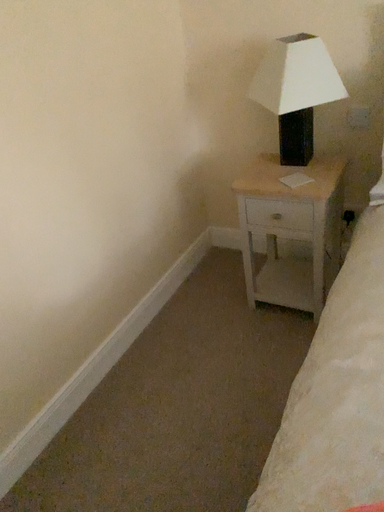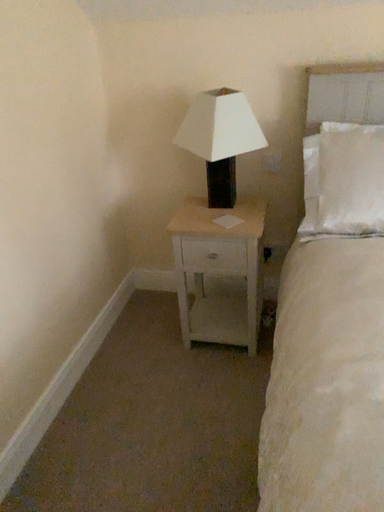
Question: Which way did the camera rotate in the video?

Choices:
 (A) rotated left
 (B) rotated right

Answer: (B)